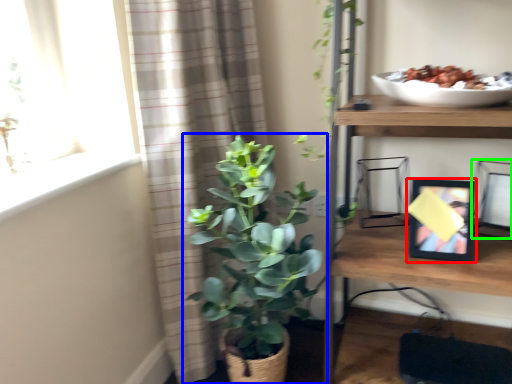
Question: Which object is positioned farthest from picture frame (highlighted by a red box)? Select from houseplant (highlighted by a blue box) and picture frame (highlighted by a green box).

Choices:
 (A) houseplant
 (B) picture frame

Answer: (A)